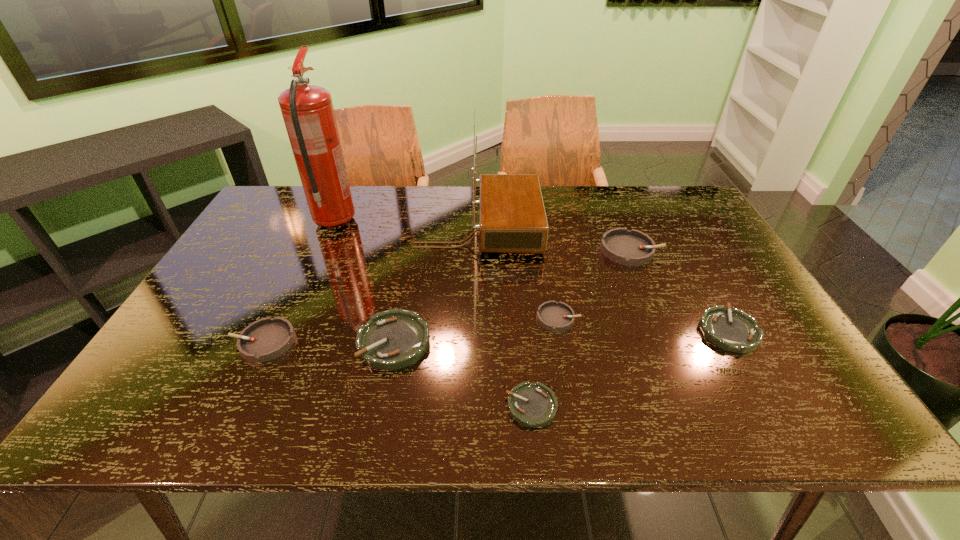
What are the coordinates of `fire extinguisher` in the screenshot? It's located at (308, 113).

You are a GUI agent. You are given a task and a screenshot of the screen. Output one action in this format:
    pyautogui.click(x=<x>, y=<y>)
    Task: Click on the tallest object
    
    Given the screenshot: What is the action you would take?
    pyautogui.click(x=308, y=113)

Identify the location of the second tallest object. (512, 219).

This screenshot has width=960, height=540. What are the coordinates of `the farthest ashtray` in the screenshot? It's located at (632, 247).

Locate an element on the screen. The image size is (960, 540). the biggest gray ashtray is located at coordinates (632, 247).

This screenshot has height=540, width=960. I want to click on the leftmost ashtray, so click(x=268, y=338).

Identify the location of the leftmost gray ashtray. (x=268, y=338).

Where is `the fifth ashtray from right to left`? The image size is (960, 540). the fifth ashtray from right to left is located at coordinates (393, 339).

Find the location of a particular element. The width and height of the screenshot is (960, 540). the biggest green ashtray is located at coordinates (393, 339).

Image resolution: width=960 pixels, height=540 pixels. Identify the location of the second gray ashtray from left to right. tap(555, 316).